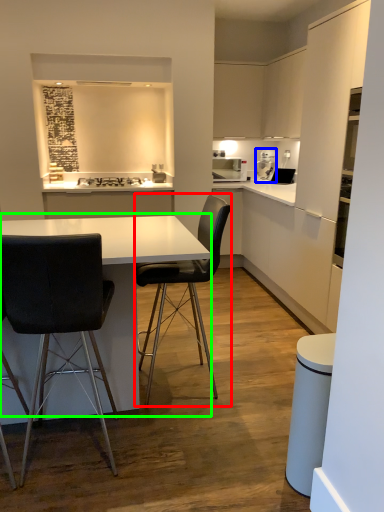
Question: Estimate the real-world distances between objects in this image. Which object is farther from chair (highlighted by a red box), coffee machine (highlighted by a blue box) or table (highlighted by a green box)?

Choices:
 (A) coffee machine
 (B) table

Answer: (A)